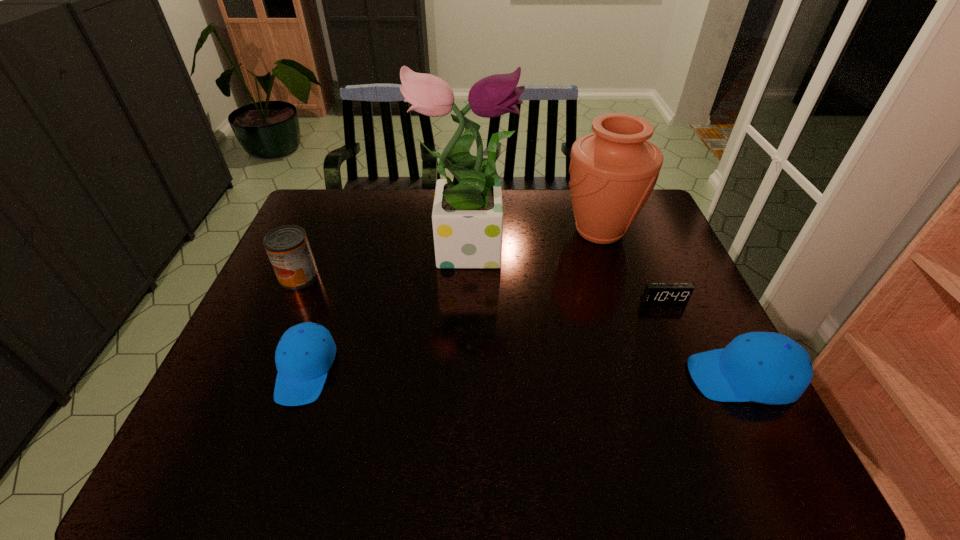
Find the location of `can that is at the left edge`. can that is at the left edge is located at coordinates (288, 248).

Locate an element on the screen. cap that is positioned at the right edge is located at coordinates (765, 367).

Locate an element on the screen. The image size is (960, 540). vase at the right edge is located at coordinates (613, 171).

You are a GUI agent. You are given a task and a screenshot of the screen. Output one action in this format:
    pyautogui.click(x=<x>, y=<y>)
    Task: Click on the alarm clock present at the right edge
    
    Given the screenshot: What is the action you would take?
    pyautogui.click(x=655, y=293)

The width and height of the screenshot is (960, 540). What are the coordinates of `object positioned at the near left corner` in the screenshot? It's located at (305, 353).

Where is `object located in the far right corner section of the desktop`? The width and height of the screenshot is (960, 540). object located in the far right corner section of the desktop is located at coordinates (613, 171).

Locate an element on the screen. This screenshot has width=960, height=540. object located in the near right corner section of the desktop is located at coordinates (765, 367).

You are a GUI agent. You are given a task and a screenshot of the screen. Output one action in this format:
    pyautogui.click(x=<x>, y=<y>)
    Task: Click on the free space at the near edge of the desktop
    This screenshot has width=960, height=540.
    Given the screenshot: What is the action you would take?
    pyautogui.click(x=443, y=389)

Where is `vacant area at the left edge`? vacant area at the left edge is located at coordinates (279, 307).

I want to click on blank area at the right edge, so click(x=639, y=272).